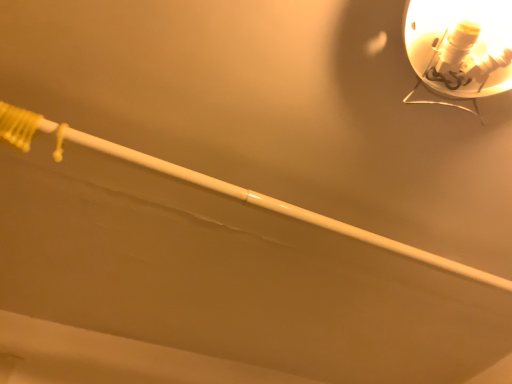
Consider the image. What is the approximate width of metallic silver lamp at upper right?

metallic silver lamp at upper right is 10.74 inches wide.

Locate an element on the screen. Image resolution: width=512 pixels, height=384 pixels. metallic silver lamp at upper right is located at coordinates (460, 47).

Describe the element at coordinates (460, 47) in the screenshot. Image resolution: width=512 pixels, height=384 pixels. I see `metallic silver lamp at upper right` at that location.

The image size is (512, 384). In order to click on metallic silver lamp at upper right in this screenshot , I will do click(460, 47).